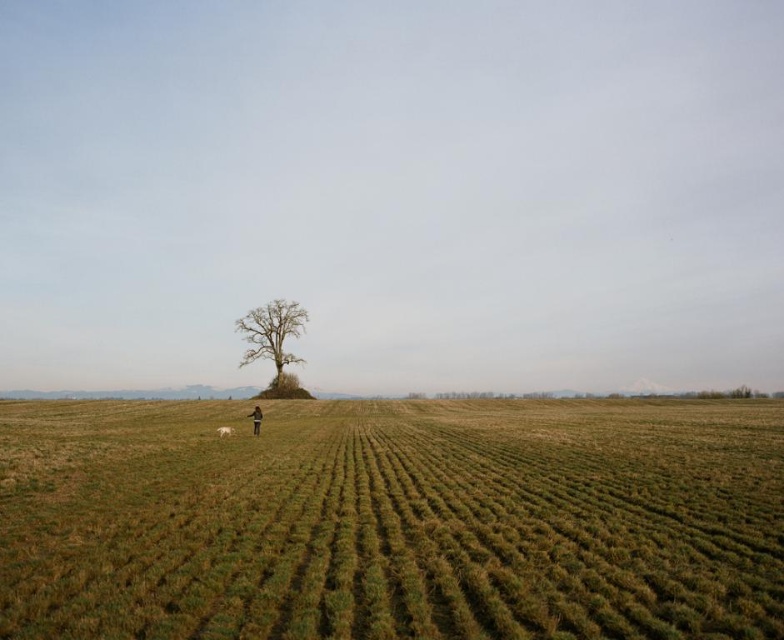
Question: From the image, what is the correct spatial relationship of green grassy field at center in relation to dark brown leather jacket at lower center?

Choices:
 (A) right
 (B) left

Answer: (A)

Question: Can you confirm if green grassy field at center is bigger than dark brown leather jacket at lower center?

Choices:
 (A) yes
 (B) no

Answer: (A)

Question: Can you confirm if bare wood tree at center is positioned below dark brown leather jacket at lower center?

Choices:
 (A) yes
 (B) no

Answer: (B)

Question: Which point is farther to the camera?

Choices:
 (A) bare wood tree at center
 (B) white fur dog at lower center
 (C) dark brown leather jacket at lower center
 (D) green grassy field at center

Answer: (A)

Question: Which point is closer to the camera?

Choices:
 (A) (224, 428)
 (B) (258, 419)
 (C) (265, 310)

Answer: (A)

Question: Among these objects, which one is farthest from the camera?

Choices:
 (A) green grassy field at center
 (B) dark brown leather jacket at lower center

Answer: (B)